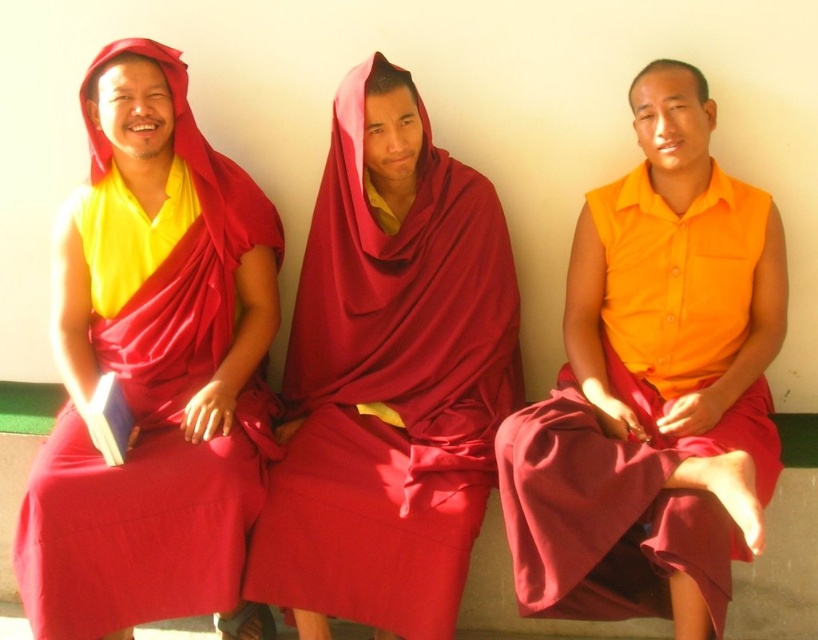
Question: In this image, where is matte red robe at left located relative to maroon silk robe at center?

Choices:
 (A) right
 (B) left

Answer: (B)

Question: Does orange matte vest at center have a lesser width compared to maroon silk robe at center?

Choices:
 (A) no
 (B) yes

Answer: (A)

Question: Can you confirm if matte red robe at left is wider than maroon silk robe at center?

Choices:
 (A) yes
 (B) no

Answer: (B)

Question: Which point is closer to the camera taking this photo?

Choices:
 (A) (74, 429)
 (B) (291, 557)

Answer: (B)

Question: Which object is the farthest from the matte red robe at left?

Choices:
 (A) maroon silk robe at center
 (B) orange matte vest at center

Answer: (B)

Question: Estimate the real-world distances between objects in this image. Which object is closer to the matte red robe at left?

Choices:
 (A) maroon silk robe at center
 (B) orange matte vest at center

Answer: (A)